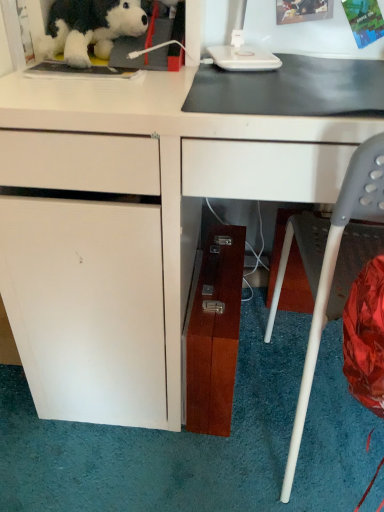
This screenshot has width=384, height=512. Describe the element at coordinates (333, 264) in the screenshot. I see `gray plastic chair at lower right` at that location.

The image size is (384, 512). What do you see at coordinates (133, 226) in the screenshot?
I see `white matte desk at center` at bounding box center [133, 226].

Find the location of a particular element. The image size is (384, 512). fluffy plush dog at upper left is located at coordinates (89, 28).

This screenshot has height=512, width=384. Identify the location of desk above the wooden file cabinet at lower center (from the image's perspective). (133, 226).

Is point (40, 382) positioned in front of point (223, 259)?

That is True.

Is white matte desk at center aimed at wooden file cabinet at lower center?

Yes, white matte desk at center is aimed at wooden file cabinet at lower center.

Is fluffy plush dog at upper left bigger or smaller than gray plastic chair at lower right?

In the image, fluffy plush dog at upper left appears to be smaller than gray plastic chair at lower right.

Consider the image. From the image's perspective, which object appears higher, fluffy plush dog at upper left or gray plastic chair at lower right?

From the image's view, fluffy plush dog at upper left is above.

Would you say fluffy plush dog at upper left is a long distance from gray plastic chair at lower right?

fluffy plush dog at upper left is near gray plastic chair at lower right, not far away.

Which is behind, fluffy plush dog at upper left or gray plastic chair at lower right?

Positioned behind is fluffy plush dog at upper left.

The image size is (384, 512). What are the coordinates of `file cabinet lying on the left of gray plastic chair at lower right` in the screenshot? It's located at (213, 332).

Which object is positioned more to the left, gray plastic chair at lower right or wooden file cabinet at lower center?

wooden file cabinet at lower center.

Can you confirm if gray plastic chair at lower right is thinner than wooden file cabinet at lower center?

In fact, gray plastic chair at lower right might be wider than wooden file cabinet at lower center.

Is point (274, 300) positioned before point (188, 369)?

No, it is not.

In terms of width, does white matte desk at center look wider or thinner when compared to gray plastic chair at lower right?

white matte desk at center is wider than gray plastic chair at lower right.

Can you tell me how much white matte desk at center and gray plastic chair at lower right differ in facing direction?

180 degrees separate the facing orientations of white matte desk at center and gray plastic chair at lower right.

Which is correct: white matte desk at center is inside gray plastic chair at lower right, or outside of it?

white matte desk at center is not inside gray plastic chair at lower right, it's outside.

Measure the distance between white matte desk at center and gray plastic chair at lower right.

12.96 inches.

Would you consider fluffy plush dog at upper left to be distant from white matte desk at center?

No, fluffy plush dog at upper left is in close proximity to white matte desk at center.

Can you confirm if fluffy plush dog at upper left is smaller than white matte desk at center?

Yes.

Can you confirm if fluffy plush dog at upper left is taller than white matte desk at center?

In fact, fluffy plush dog at upper left may be shorter than white matte desk at center.

Which object is thinner, fluffy plush dog at upper left or white matte desk at center?

Thinner between the two is fluffy plush dog at upper left.

Is wooden file cabinet at lower center aimed at white matte desk at center?

Yes, wooden file cabinet at lower center is turned towards white matte desk at center.

From a real-world perspective, is wooden file cabinet at lower center beneath white matte desk at center?

Yes, from a real-world perspective, wooden file cabinet at lower center is under white matte desk at center.

Relative to white matte desk at center, is wooden file cabinet at lower center in front or behind?

wooden file cabinet at lower center is positioned farther from the viewer than white matte desk at center.

What's the angular difference between gray plastic chair at lower right and fluffy plush dog at upper left's facing directions?

177 degrees separate the facing orientations of gray plastic chair at lower right and fluffy plush dog at upper left.

Is the depth of gray plastic chair at lower right less than that of fluffy plush dog at upper left?

Yes, gray plastic chair at lower right is closer to the viewer.

Is gray plastic chair at lower right aimed at fluffy plush dog at upper left?

No, gray plastic chair at lower right is not facing towards fluffy plush dog at upper left.

Considering the relative positions of gray plastic chair at lower right and fluffy plush dog at upper left in the image provided, is gray plastic chair at lower right to the left or to the right of fluffy plush dog at upper left?

In the image, gray plastic chair at lower right appears on the right side of fluffy plush dog at upper left.

Image resolution: width=384 pixels, height=512 pixels. In order to click on desk located on the right of wooden file cabinet at lower center in this screenshot , I will do `click(133, 226)`.

Where is `chair that is under the fluffy plush dog at upper left (from a real-world perspective)`? chair that is under the fluffy plush dog at upper left (from a real-world perspective) is located at coordinates (333, 264).

Looking at the image, which one is located closer to wooden file cabinet at lower center, white matte desk at center or fluffy plush dog at upper left?

Among the two, white matte desk at center is located nearer to wooden file cabinet at lower center.

Looking at the image, which one is located further to white matte desk at center, fluffy plush dog at upper left or wooden file cabinet at lower center?

Based on the image, fluffy plush dog at upper left appears to be further to white matte desk at center.

Considering their positions, is wooden file cabinet at lower center positioned further to white matte desk at center than gray plastic chair at lower right?

Among the two, gray plastic chair at lower right is located further to white matte desk at center.

Estimate the real-world distances between objects in this image. Which object is further from fluffy plush dog at upper left, white matte desk at center or wooden file cabinet at lower center?

wooden file cabinet at lower center lies further to fluffy plush dog at upper left than the other object.

When comparing their distances from gray plastic chair at lower right, does white matte desk at center or wooden file cabinet at lower center seem closer?

wooden file cabinet at lower center.

Which object lies further to the anchor point white matte desk at center, gray plastic chair at lower right or wooden file cabinet at lower center?

Among the two, gray plastic chair at lower right is located further to white matte desk at center.

From the image, which object appears to be farther from wooden file cabinet at lower center, gray plastic chair at lower right or fluffy plush dog at upper left?

Among the two, fluffy plush dog at upper left is located further to wooden file cabinet at lower center.

Estimate the real-world distances between objects in this image. Which object is further from gray plastic chair at lower right, wooden file cabinet at lower center or white matte desk at center?

Based on the image, white matte desk at center appears to be further to gray plastic chair at lower right.

Where is `desk between gray plastic chair at lower right and wooden file cabinet at lower center from front to back`? The height and width of the screenshot is (512, 384). desk between gray plastic chair at lower right and wooden file cabinet at lower center from front to back is located at coordinates (133, 226).

You are a GUI agent. You are given a task and a screenshot of the screen. Output one action in this format:
    pyautogui.click(x=<x>, y=<y>)
    Task: Click on the chair between fluffy plush dog at upper left and wooden file cabinet at lower center vertically
    This screenshot has height=512, width=384.
    Given the screenshot: What is the action you would take?
    pyautogui.click(x=333, y=264)

Locate an element on the screen. This screenshot has height=512, width=384. desk between fluffy plush dog at upper left and gray plastic chair at lower right is located at coordinates (133, 226).

You are a GUI agent. You are given a task and a screenshot of the screen. Output one action in this format:
    pyautogui.click(x=<x>, y=<y>)
    Task: Click on the desk between fluffy plush dog at upper left and wooden file cabinet at lower center in the up-down direction
    The width and height of the screenshot is (384, 512).
    Given the screenshot: What is the action you would take?
    pyautogui.click(x=133, y=226)